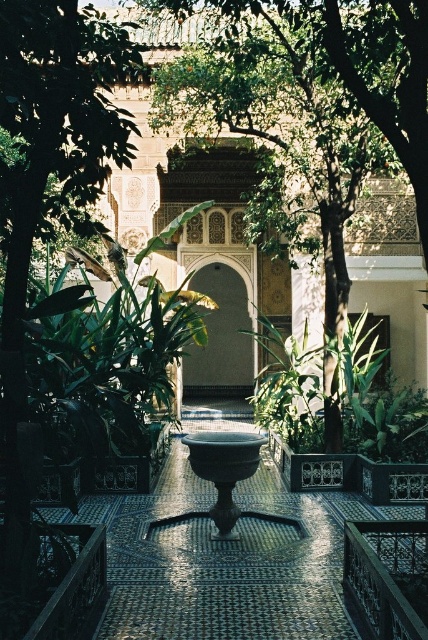
Does shiny metal bowl at center appear over bronze bowl at center?

Actually, shiny metal bowl at center is below bronze bowl at center.

Identify the location of shiny metal bowl at center. This screenshot has width=428, height=640. (225, 557).

Is shiny metal bowl at center below matte stone archway at center?

Yes, shiny metal bowl at center is below matte stone archway at center.

Is shiny metal bowl at center smaller than matte stone archway at center?

Yes, shiny metal bowl at center is smaller than matte stone archway at center.

This screenshot has height=640, width=428. What do you see at coordinates (225, 557) in the screenshot? I see `shiny metal bowl at center` at bounding box center [225, 557].

In order to click on shiny metal bowl at center in this screenshot , I will do `click(225, 557)`.

Who is shorter, matte stone archway at center or bronze bowl at center?

bronze bowl at center

Can you confirm if matte stone archway at center is smaller than bronze bowl at center?

No.

Is point (237, 289) closer to viewer compared to point (219, 476)?

No, (237, 289) is behind (219, 476).

Identify the location of matte stone archway at center. (220, 339).